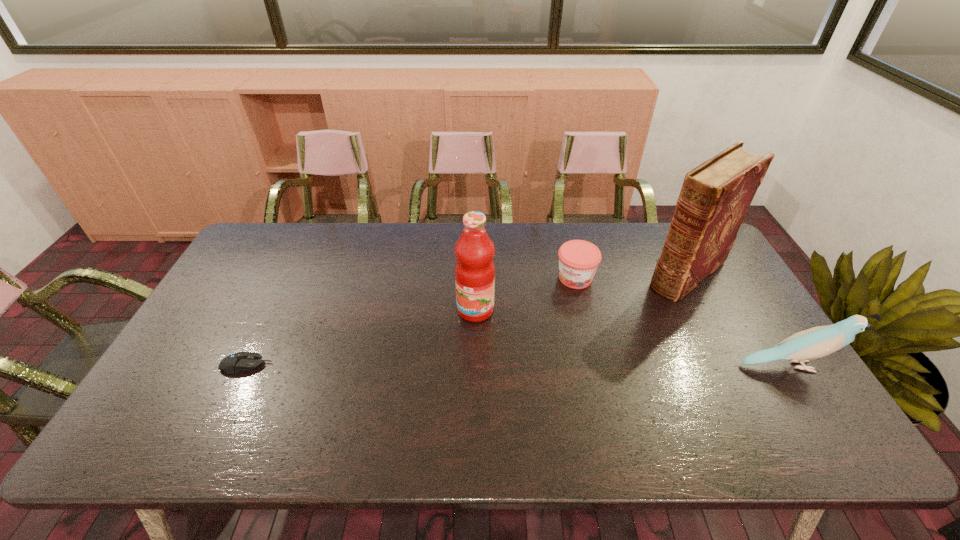
Where is `the leftmost object`? The width and height of the screenshot is (960, 540). the leftmost object is located at coordinates (237, 362).

Where is `the shortest object`? The image size is (960, 540). the shortest object is located at coordinates (237, 362).

You are a GUI agent. You are given a task and a screenshot of the screen. Output one action in this format:
    pyautogui.click(x=<x>, y=<y>)
    Task: Click on the third tallest object
    The image size is (960, 540).
    Given the screenshot: What is the action you would take?
    pyautogui.click(x=820, y=341)

The width and height of the screenshot is (960, 540). I want to click on the fourth tallest object, so click(x=578, y=260).

Locate an element on the screen. The image size is (960, 540). jam is located at coordinates (578, 260).

Locate an element on the screen. This screenshot has height=540, width=960. the tallest object is located at coordinates (716, 195).

Find the location of a particular element. The width and height of the screenshot is (960, 540). fruit juice is located at coordinates (474, 270).

The width and height of the screenshot is (960, 540). In order to click on the second tallest object in this screenshot , I will do 474,270.

Image resolution: width=960 pixels, height=540 pixels. Find the location of `vacant space situated 0.060m on the left of the leftmost object`. vacant space situated 0.060m on the left of the leftmost object is located at coordinates (198, 366).

Locate an element on the screen. free location located on the front label of the third object from right to left is located at coordinates (559, 307).